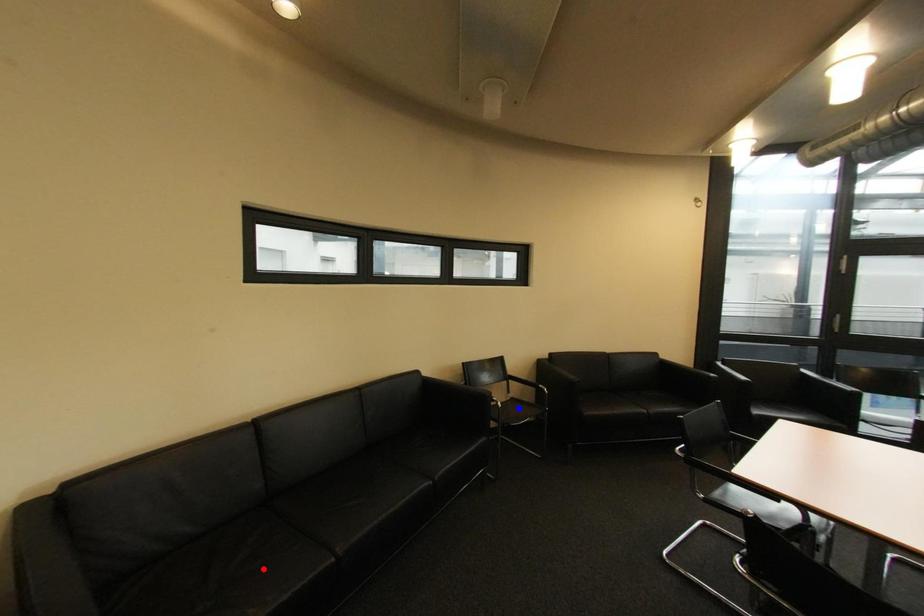
Question: Which of the two points in the image is closer to the camera?

Choices:
 (A) Blue point is closer.
 (B) Red point is closer.

Answer: (B)